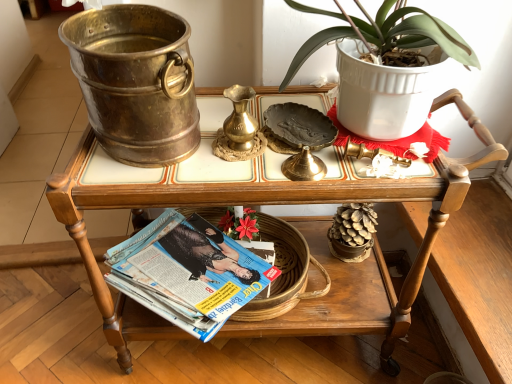
Question: Is matte paper magazine at lower center spatially inside wooden serving cart at center, or outside of it?

Choices:
 (A) outside
 (B) inside

Answer: (B)

Question: Is matte paper magazine at lower center bigger or smaller than wooden serving cart at center?

Choices:
 (A) big
 (B) small

Answer: (B)

Question: Is point (233, 244) closer or farther from the camera than point (87, 145)?

Choices:
 (A) farther
 (B) closer

Answer: (A)

Question: From a real-world perspective, relative to matte paper magazine at lower center, is wooden serving cart at center vertically above or below?

Choices:
 (A) below
 (B) above

Answer: (B)

Question: Is wooden serving cart at center spatially inside matte paper magazine at lower center, or outside of it?

Choices:
 (A) outside
 (B) inside

Answer: (A)

Question: Visually, is wooden serving cart at center positioned to the left or to the right of matte paper magazine at lower center?

Choices:
 (A) left
 (B) right

Answer: (B)

Question: Considering the positions of wooden serving cart at center and matte paper magazine at lower center in the image, is wooden serving cart at center wider or thinner than matte paper magazine at lower center?

Choices:
 (A) wide
 (B) thin

Answer: (A)